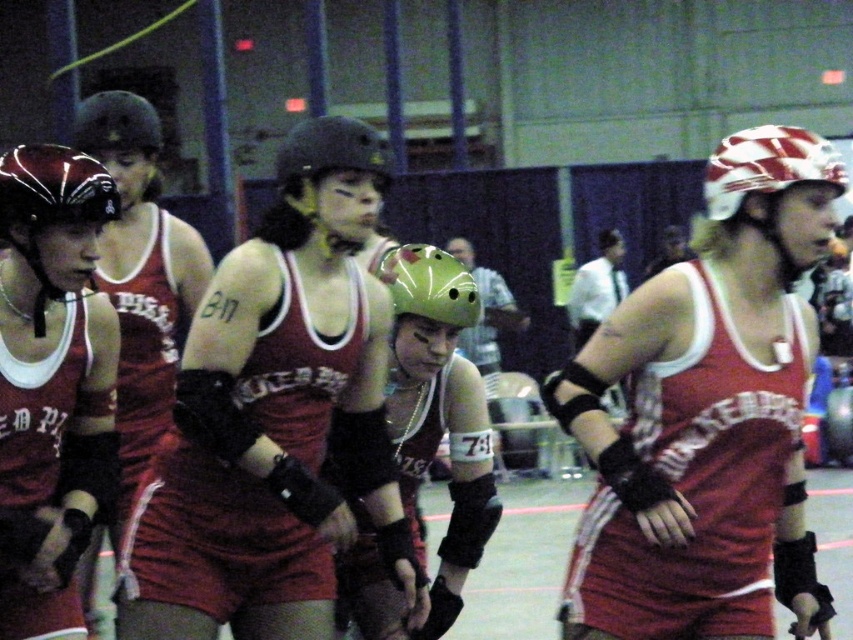
Question: Which point appears closest to the camera in this image?

Choices:
 (A) (770, 196)
 (B) (663, 480)
 (C) (28, 161)

Answer: (A)

Question: Is matte red tank top at center positioned at the back of shiny black helmet at upper left?

Choices:
 (A) no
 (B) yes

Answer: (A)

Question: Is matte red helmet at center further to camera compared to matte green helmet at center?

Choices:
 (A) no
 (B) yes

Answer: (A)

Question: Which object is closer to the camera taking this photo?

Choices:
 (A) matte red helmet at left
 (B) shiny black helmet at upper left

Answer: (A)

Question: From the image, what is the correct spatial relationship of matte red tank top at center in relation to matte red uniform at left?

Choices:
 (A) below
 (B) above

Answer: (A)

Question: Which point is closer to the camera taking this photo?

Choices:
 (A) (341, 161)
 (B) (416, 360)
 (C) (769, 141)

Answer: (C)